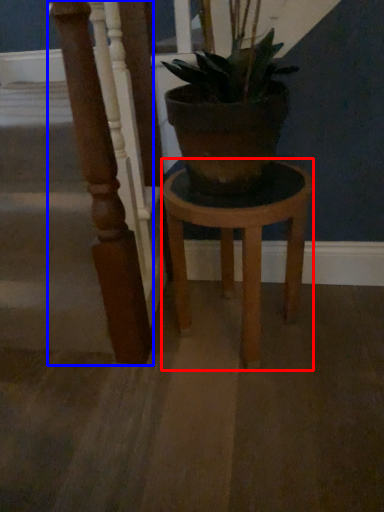
Question: Among these objects, which one is farthest to the camera, stool (highlighted by a red box) or pillar (highlighted by a blue box)?

Choices:
 (A) stool
 (B) pillar

Answer: (A)